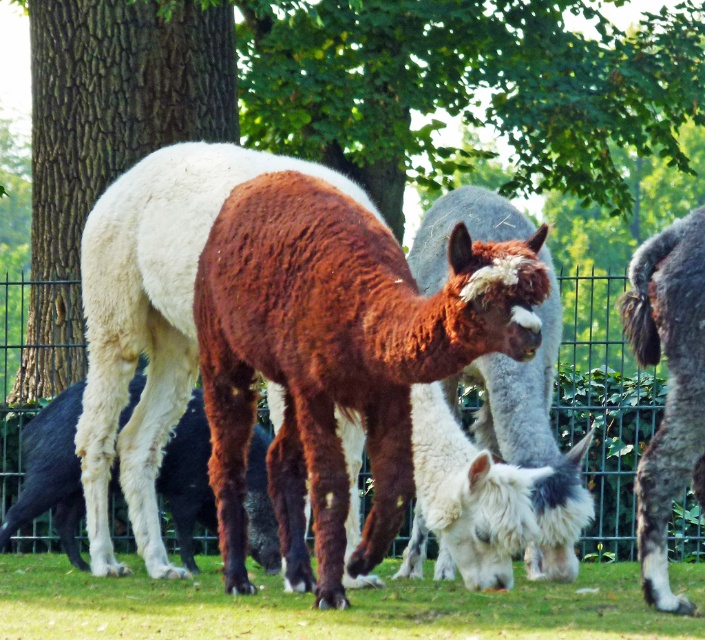
The image size is (705, 640). Describe the element at coordinates (470, 88) in the screenshot. I see `brown textured alpaca at center` at that location.

Is point (228, 12) behind point (18, 300)?

No, it is not.

Locate an element on the screen. The image size is (705, 640). brown textured alpaca at center is located at coordinates (470, 88).

Who is positioned more to the left, brown textured alpaca at center or brown textured tree trunk at upper left?

From the viewer's perspective, brown textured tree trunk at upper left appears more on the left side.

Is brown textured alpaca at center below brown textured tree trunk at upper left?

Actually, brown textured alpaca at center is above brown textured tree trunk at upper left.

Locate an element on the screen. Image resolution: width=705 pixels, height=640 pixels. brown textured alpaca at center is located at coordinates (470, 88).

Locate an element on the screen. The height and width of the screenshot is (640, 705). brown textured alpaca at center is located at coordinates (470, 88).

The height and width of the screenshot is (640, 705). What do you see at coordinates (106, 138) in the screenshot?
I see `brown textured tree trunk at upper left` at bounding box center [106, 138].

Is brown textured tree trunk at upper left positioned behind green grass at lower center?

Yes, brown textured tree trunk at upper left is further from the viewer.

Which is behind, point (56, 157) or point (697, 632)?

Point (56, 157)

The width and height of the screenshot is (705, 640). I want to click on brown textured tree trunk at upper left, so click(x=106, y=138).